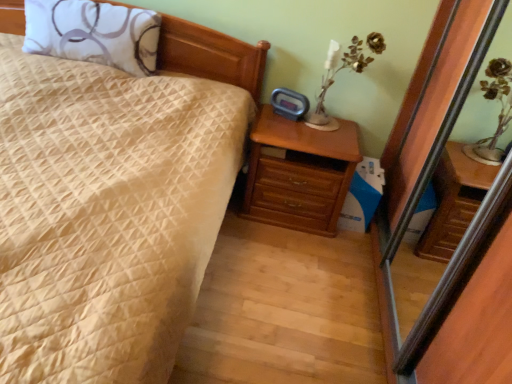
Question: From the image's perspective, is beige quilted bed at center below transparent glass screen door at right?

Choices:
 (A) yes
 (B) no

Answer: (B)

Question: Is beige quilted bed at center located outside transparent glass screen door at right?

Choices:
 (A) yes
 (B) no

Answer: (A)

Question: Considering the relative sizes of beige quilted bed at center and transparent glass screen door at right in the image provided, is beige quilted bed at center wider than transparent glass screen door at right?

Choices:
 (A) no
 (B) yes

Answer: (B)

Question: Does beige quilted bed at center have a greater height compared to transparent glass screen door at right?

Choices:
 (A) yes
 (B) no

Answer: (B)

Question: Is beige quilted bed at center looking in the opposite direction of transparent glass screen door at right?

Choices:
 (A) yes
 (B) no

Answer: (B)

Question: From a real-world perspective, is metallic gold flower at upper right physically located above or below transparent glass screen door at right?

Choices:
 (A) above
 (B) below

Answer: (A)

Question: Is point (378, 41) closer or farther from the camera than point (464, 69)?

Choices:
 (A) closer
 (B) farther

Answer: (B)

Question: In the image, is metallic gold flower at upper right positioned in front of or behind transparent glass screen door at right?

Choices:
 (A) front
 (B) behind

Answer: (B)

Question: From the image's perspective, is metallic gold flower at upper right above or below transparent glass screen door at right?

Choices:
 (A) below
 (B) above

Answer: (B)

Question: In terms of size, does beige quilted bed at center appear bigger or smaller than white printed pillow at upper left?

Choices:
 (A) small
 (B) big

Answer: (B)

Question: In terms of height, does beige quilted bed at center look taller or shorter compared to white printed pillow at upper left?

Choices:
 (A) tall
 (B) short

Answer: (A)

Question: From the image's perspective, is beige quilted bed at center positioned above or below white printed pillow at upper left?

Choices:
 (A) below
 (B) above

Answer: (A)

Question: Considering their positions, is beige quilted bed at center located in front of or behind white printed pillow at upper left?

Choices:
 (A) front
 (B) behind

Answer: (A)

Question: Would you say metallic gold flower at upper right is to the left or to the right of white printed pillow at upper left in the picture?

Choices:
 (A) left
 (B) right

Answer: (B)

Question: From their relative heights in the image, would you say metallic gold flower at upper right is taller or shorter than white printed pillow at upper left?

Choices:
 (A) tall
 (B) short

Answer: (B)